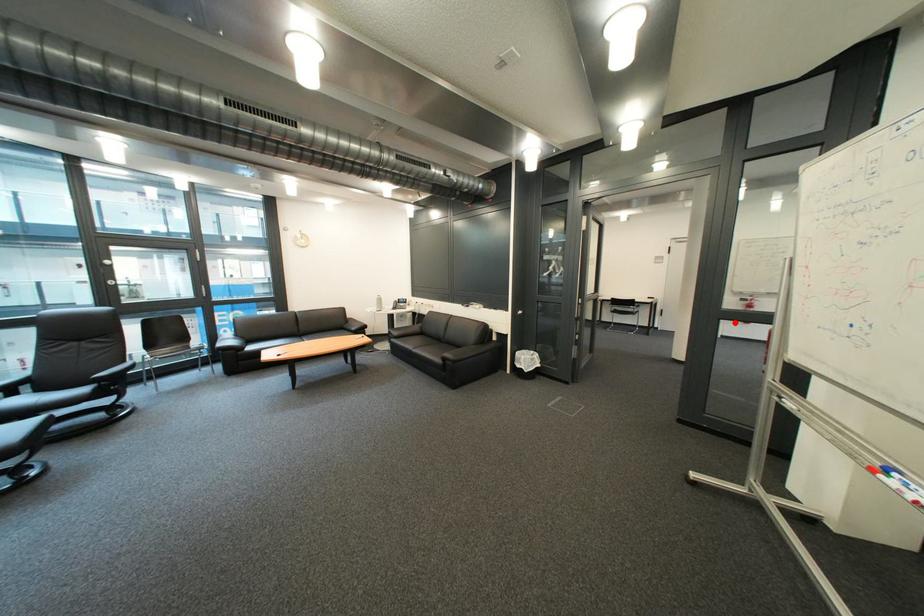
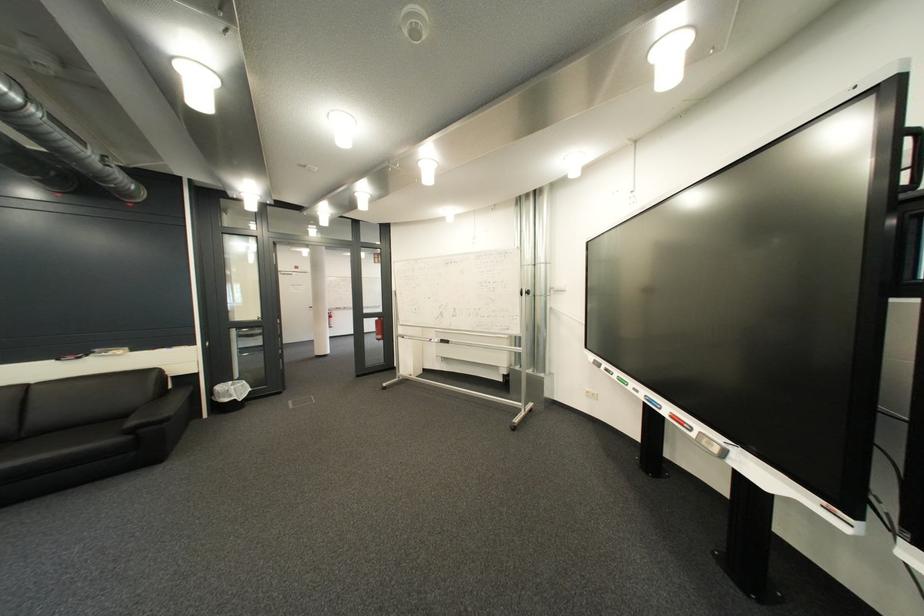
The point at the highlighted location is marked in the first image. Where is the corresponding point in the second image?

(379, 321)